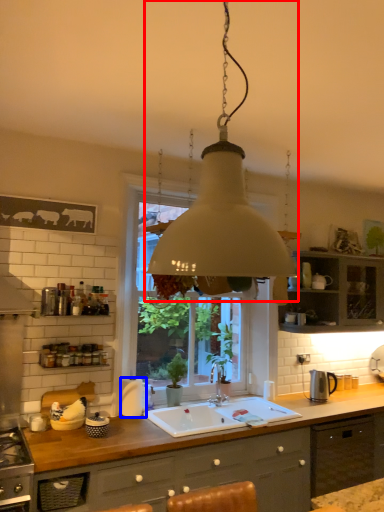
Question: Among these objects, which one is farthest to the camera, lamp (highlighted by a red box) or appliance (highlighted by a blue box)?

Choices:
 (A) lamp
 (B) appliance

Answer: (B)